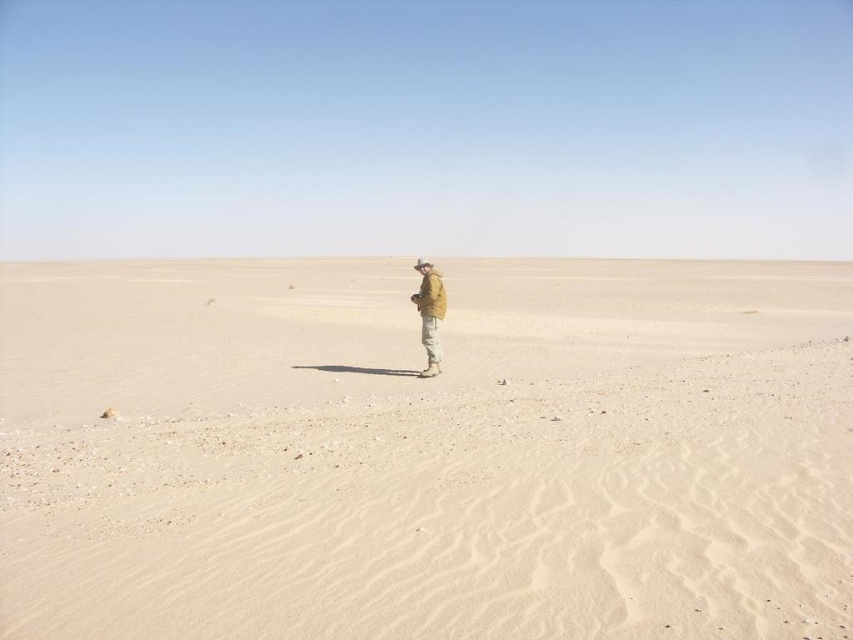
Is light beige sand at center bigger than tan fabric jacket at center?

Yes, light beige sand at center is bigger than tan fabric jacket at center.

Which is in front, point (4, 268) or point (432, 291)?

Point (432, 291) is in front.

Between point (606, 433) and point (427, 304), which one is positioned behind?

Positioned behind is point (427, 304).

Where is `light beige sand at center`? The image size is (853, 640). light beige sand at center is located at coordinates (425, 451).